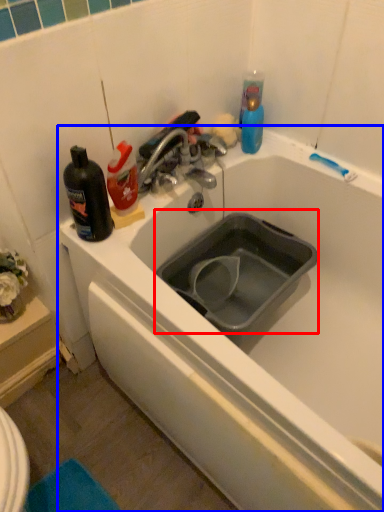
Question: Which object appears farthest to the camera in this image, sink (highlighted by a red box) or bathtub (highlighted by a blue box)?

Choices:
 (A) sink
 (B) bathtub

Answer: (A)